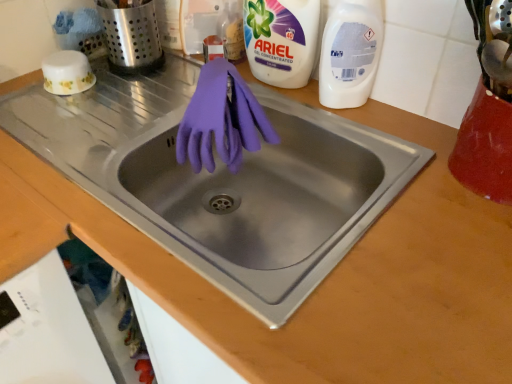
Question: Is matte purple gloves at center far away from white plastic dishwasher at lower left?

Choices:
 (A) no
 (B) yes

Answer: (A)

Question: Is white plastic dishwasher at lower left a part of matte purple gloves at center?

Choices:
 (A) yes
 (B) no

Answer: (B)

Question: Is matte purple gloves at center closer to camera compared to white plastic dishwasher at lower left?

Choices:
 (A) no
 (B) yes

Answer: (B)

Question: Can you confirm if matte purple gloves at center is bigger than white plastic dishwasher at lower left?

Choices:
 (A) yes
 (B) no

Answer: (B)

Question: Is matte purple gloves at center placed right next to white plastic dishwasher at lower left?

Choices:
 (A) no
 (B) yes

Answer: (A)

Question: From a real-world perspective, is white plastic dishwasher at lower left positioned above or below purple rubber gloves at center?

Choices:
 (A) below
 (B) above

Answer: (A)

Question: Is point (101, 380) closer or farther from the camera than point (178, 137)?

Choices:
 (A) closer
 (B) farther

Answer: (B)

Question: Is white plastic dishwasher at lower left bigger or smaller than purple rubber gloves at center?

Choices:
 (A) small
 (B) big

Answer: (B)

Question: From the image's perspective, is white plastic dishwasher at lower left positioned above or below purple rubber gloves at center?

Choices:
 (A) above
 (B) below

Answer: (B)

Question: Is brushed metal utensil holder at upper left spatially inside purple rubber gloves at center, or outside of it?

Choices:
 (A) inside
 (B) outside

Answer: (B)

Question: Considering the positions of brushed metal utensil holder at upper left and purple rubber gloves at center in the image, is brushed metal utensil holder at upper left wider or thinner than purple rubber gloves at center?

Choices:
 (A) thin
 (B) wide

Answer: (B)

Question: Does point (122, 57) appear closer or farther from the camera than point (217, 140)?

Choices:
 (A) closer
 (B) farther

Answer: (B)

Question: Considering their positions, is brushed metal utensil holder at upper left located in front of or behind purple rubber gloves at center?

Choices:
 (A) behind
 (B) front

Answer: (A)

Question: Based on their sizes in the image, would you say purple rubber gloves at center is bigger or smaller than white gel concentrated at upper right, which ranks as the first cleaning product in left-to-right order?

Choices:
 (A) small
 (B) big

Answer: (A)

Question: Considering the positions of purple rubber gloves at center and white gel concentrated at upper right, which ranks as the first cleaning product in left-to-right order, in the image, is purple rubber gloves at center wider or thinner than white gel concentrated at upper right, which ranks as the first cleaning product in left-to-right order,?

Choices:
 (A) thin
 (B) wide

Answer: (A)